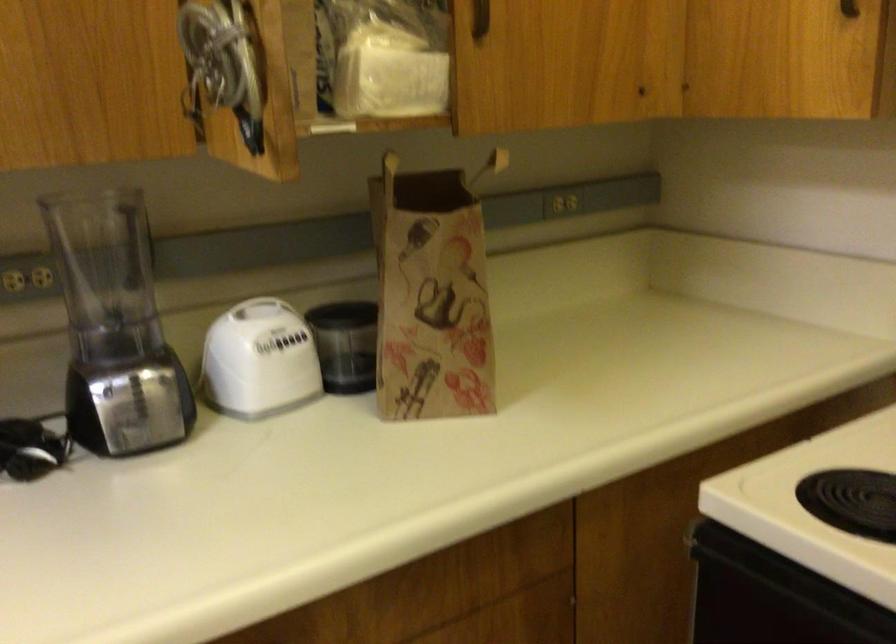
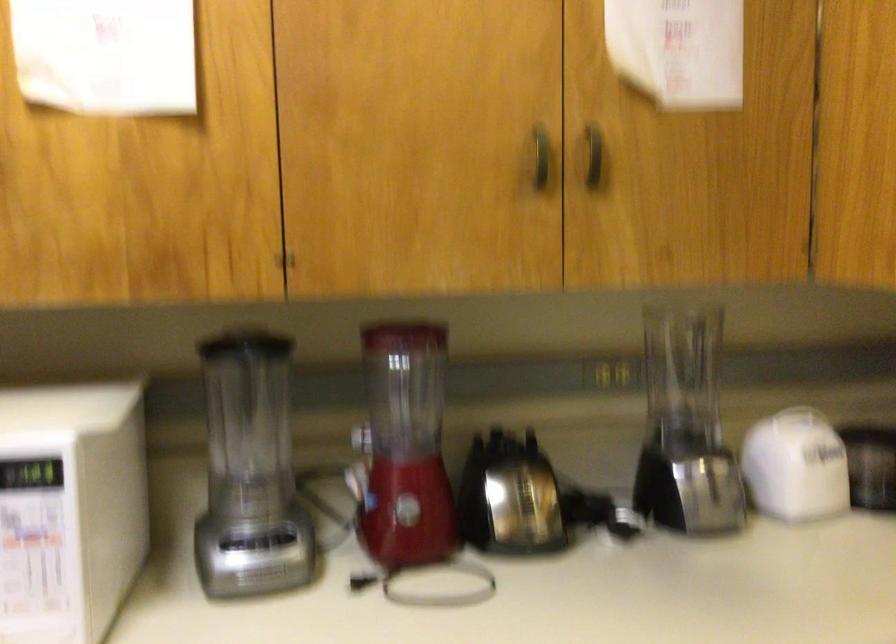
Which direction would the cameraman need to move to produce the second image?

The cameraman walked toward left, backward.